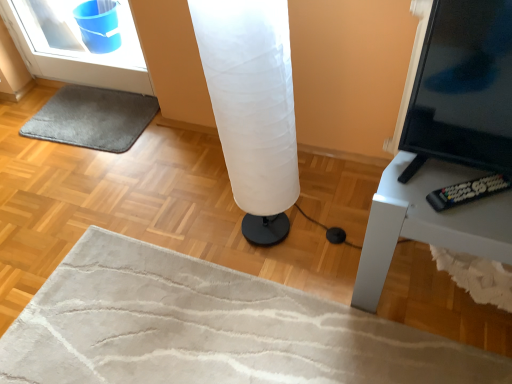
Question: Is black glossy screen at right closer to camera compared to gray soft rug at lower left?

Choices:
 (A) no
 (B) yes

Answer: (B)

Question: Does black glossy screen at right appear on the left side of gray soft rug at lower left?

Choices:
 (A) yes
 (B) no

Answer: (B)

Question: Is black glossy screen at right wider than gray soft rug at lower left?

Choices:
 (A) no
 (B) yes

Answer: (A)

Question: Is black glossy screen at right positioned far away from gray soft rug at lower left?

Choices:
 (A) no
 (B) yes

Answer: (B)

Question: Does black glossy screen at right have a smaller size compared to gray soft rug at lower left?

Choices:
 (A) yes
 (B) no

Answer: (B)

Question: Is black glossy screen at right further to camera compared to gray soft rug at lower left?

Choices:
 (A) no
 (B) yes

Answer: (A)

Question: Is black glossy screen at right in front of white fabric lamp at center?

Choices:
 (A) no
 (B) yes

Answer: (B)

Question: Considering the relative sizes of black glossy screen at right and white fabric lamp at center in the image provided, is black glossy screen at right taller than white fabric lamp at center?

Choices:
 (A) no
 (B) yes

Answer: (A)

Question: From a real-world perspective, is black glossy screen at right beneath white fabric lamp at center?

Choices:
 (A) no
 (B) yes

Answer: (A)

Question: Is black glossy screen at right bigger than white fabric lamp at center?

Choices:
 (A) yes
 (B) no

Answer: (B)

Question: Is black glossy screen at right positioned behind white fabric lamp at center?

Choices:
 (A) no
 (B) yes

Answer: (A)

Question: Is there a large distance between black glossy screen at right and white fabric lamp at center?

Choices:
 (A) yes
 (B) no

Answer: (B)

Question: Could white fabric lamp at center be considered to be inside gray soft rug at lower left?

Choices:
 (A) no
 (B) yes

Answer: (A)